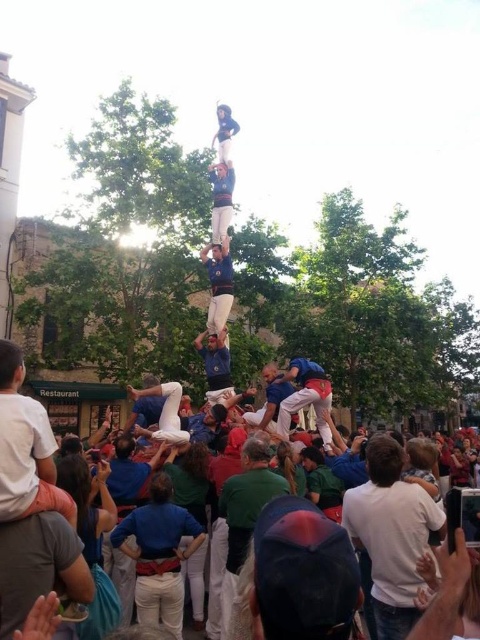
Does white cotton shirt at center have a greater height compared to white cotton shirt at lower left?

Indeed, white cotton shirt at center has a greater height compared to white cotton shirt at lower left.

From the picture: Is white cotton shirt at center below white cotton shirt at lower left?

Correct, white cotton shirt at center is located below white cotton shirt at lower left.

This screenshot has height=640, width=480. I want to click on white cotton shirt at center, so click(x=391, y=534).

Measure the distance between white cotton crowd at lower center and camera.

white cotton crowd at lower center is 107.65 feet from camera.

Can you confirm if white cotton crowd at lower center is positioned to the right of blue fabric man at center?

In fact, white cotton crowd at lower center is to the left of blue fabric man at center.

Which is behind, point (436, 598) or point (323, 432)?

Point (323, 432)

The image size is (480, 640). Identify the location of white cotton crowd at lower center. (445, 593).

Does white cotton shirt at center have a greater height compared to blue fabric man at center?

Correct, white cotton shirt at center is much taller as blue fabric man at center.

Locate an element on the screen. The height and width of the screenshot is (640, 480). white cotton shirt at center is located at coordinates (391, 534).